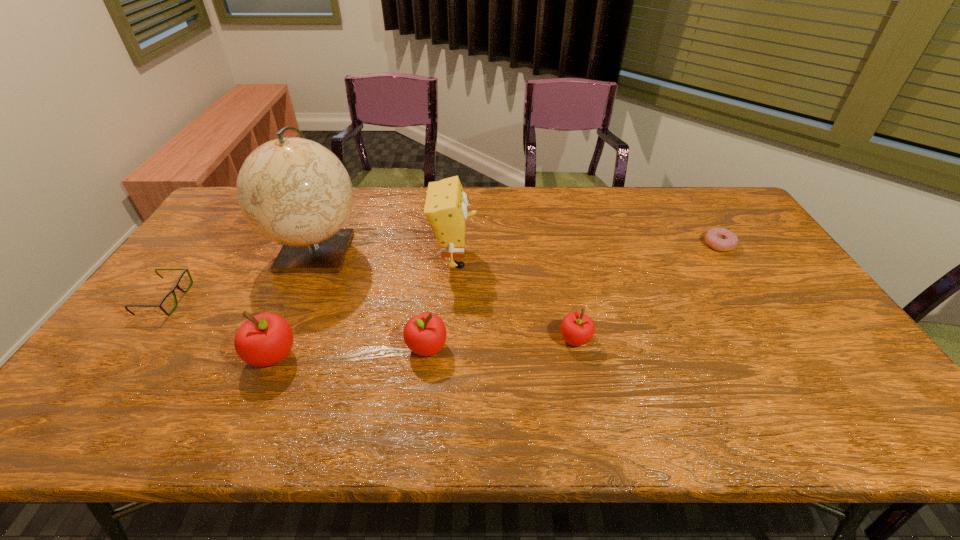
This screenshot has height=540, width=960. Find the location of `the shortest object`. the shortest object is located at coordinates (720, 239).

At what (x,y) coordinates should I click in order to perform the action: click on sponge. Please return your answer as a coordinate pair (x, y). This screenshot has height=540, width=960. Looking at the image, I should click on (446, 207).

I want to click on vacant space located on the left of the leftmost apple, so click(158, 355).

Find the location of `vacant area situated on the back of the fourth shortest object`. vacant area situated on the back of the fourth shortest object is located at coordinates (439, 246).

Locate an element on the screen. This screenshot has width=960, height=540. vacant space located on the back of the sixth object from left to right is located at coordinates 558,253.

Find the location of a particular element. The width and height of the screenshot is (960, 540). vacant space located 0.100m on the surface of the globe showing Europe and Africa is located at coordinates (290, 310).

Image resolution: width=960 pixels, height=540 pixels. Find the location of `free space located on the lens of the leftmost object`. free space located on the lens of the leftmost object is located at coordinates (207, 299).

Image resolution: width=960 pixels, height=540 pixels. In order to click on free space located on the left of the shortest object in this screenshot , I will do `click(605, 245)`.

At what (x,y) coordinates should I click in order to perform the action: click on vacant space located on the face of the sponge. Please return your answer as a coordinate pair (x, y). The width and height of the screenshot is (960, 540). Looking at the image, I should click on (599, 259).

At what (x,y) coordinates should I click in order to perform the action: click on object that is at the far edge. Please return your answer as a coordinate pair (x, y). This screenshot has width=960, height=540. Looking at the image, I should click on (294, 191).